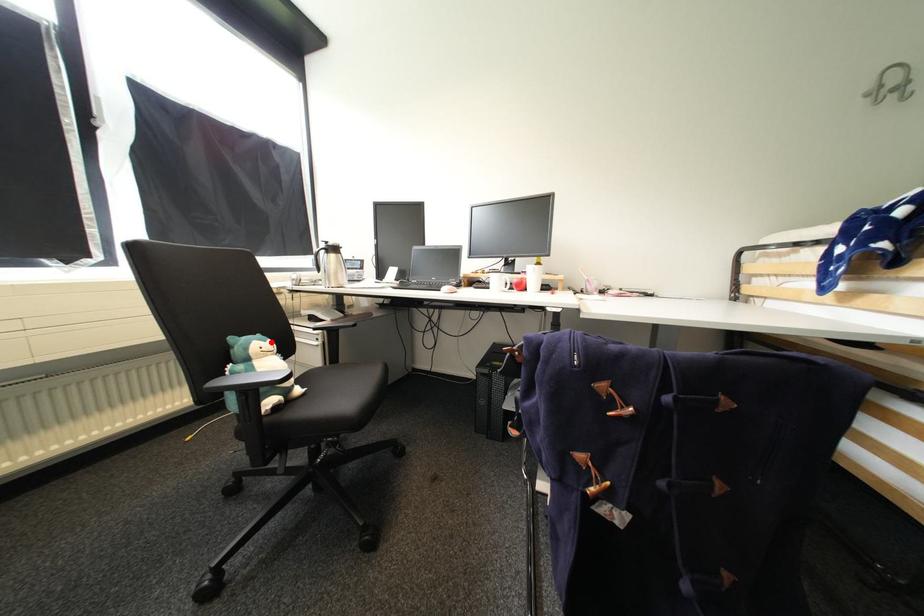
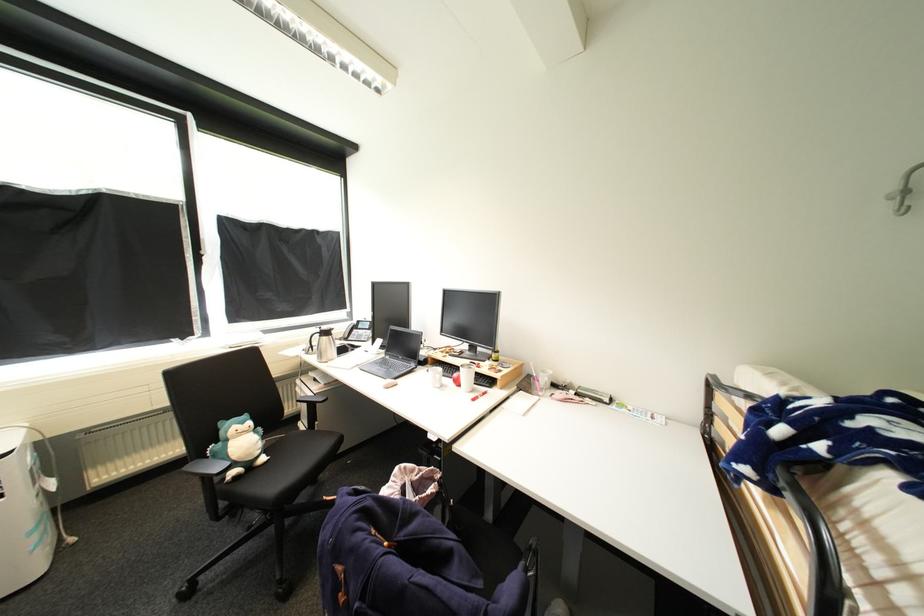
The point at the highlighted location is marked in the first image. Where is the corresponding point in the second image?

(249, 424)